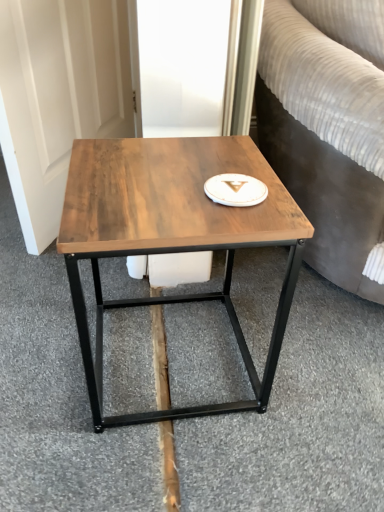
Find the location of a particular element. vacant area that is in front of white glossy platter at center is located at coordinates (225, 225).